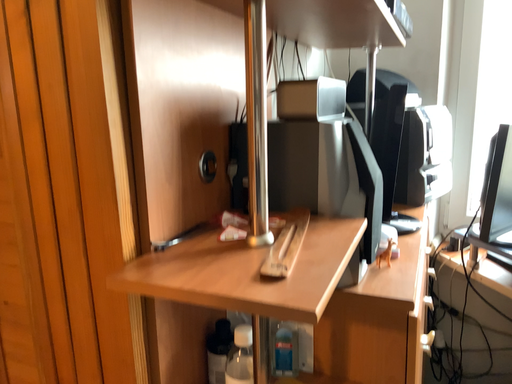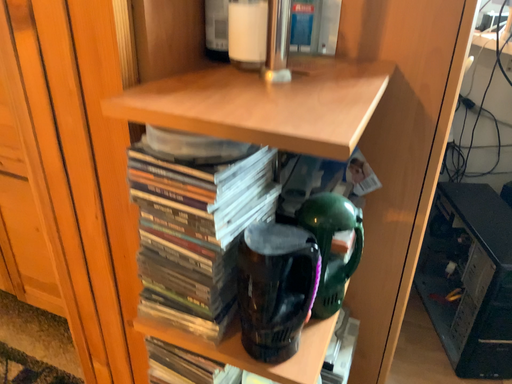
Question: How did the camera likely rotate when shooting the video?

Choices:
 (A) rotated downward
 (B) rotated upward

Answer: (A)